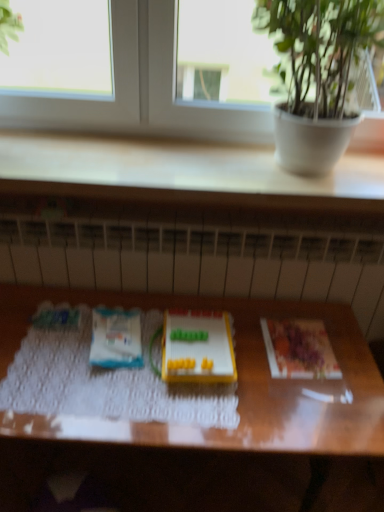
Locate an element on the screen. The width and height of the screenshot is (384, 512). vacant area situated below printed paper at right, which appears as the first paperback book when viewed from the right (from a real-world perspective) is located at coordinates (296, 346).